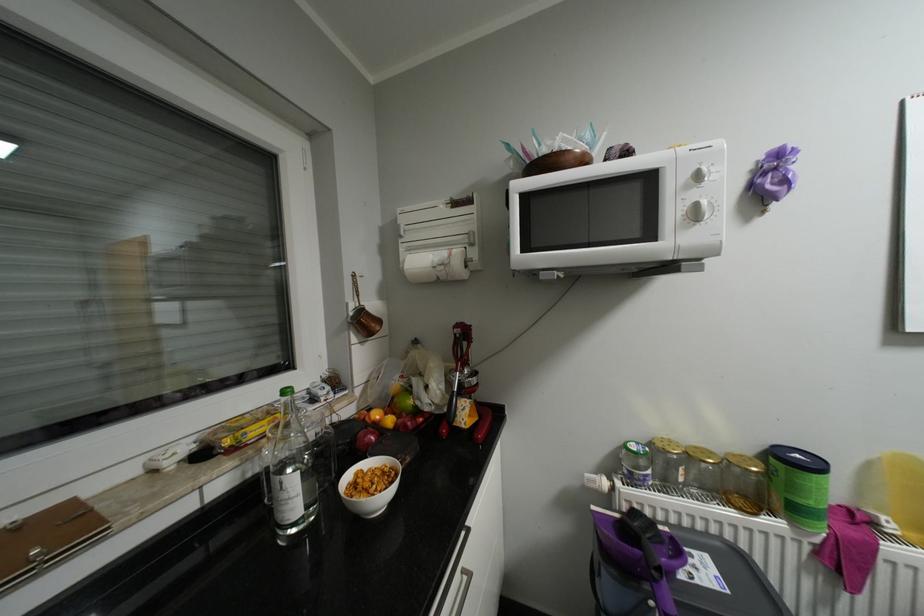
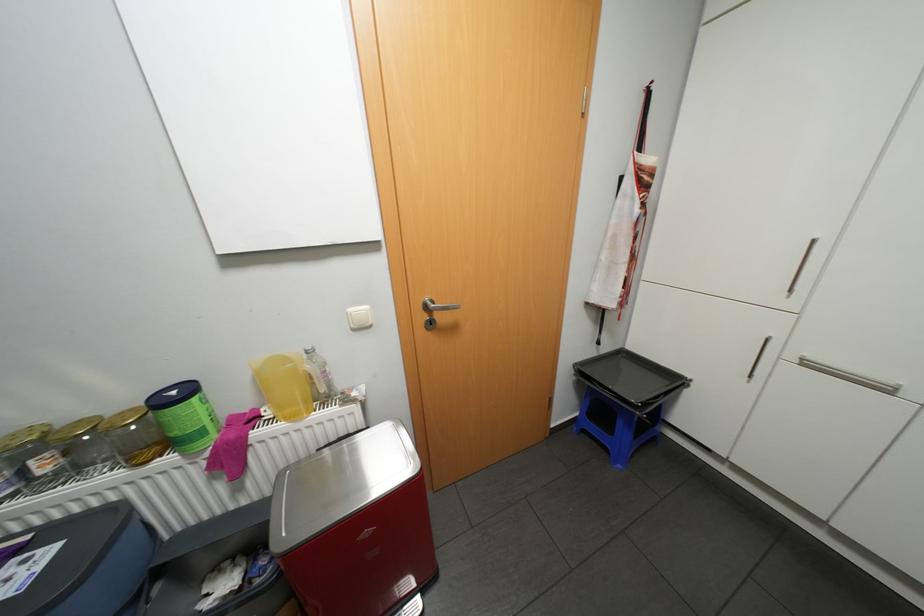
Locate, in the second image, the point that corresponds to the point at 800,524 in the first image.

(190, 453)